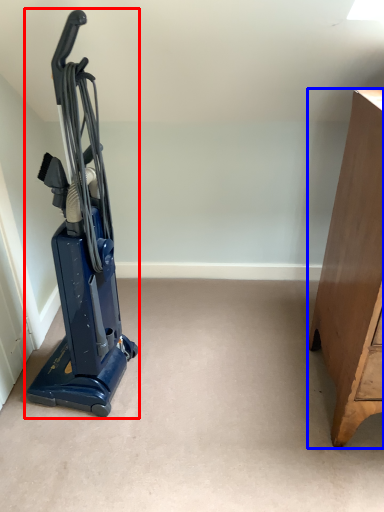
Question: Among these objects, which one is nearest to the camera, home appliance (highlighted by a red box) or furniture (highlighted by a blue box)?

Choices:
 (A) home appliance
 (B) furniture

Answer: (B)